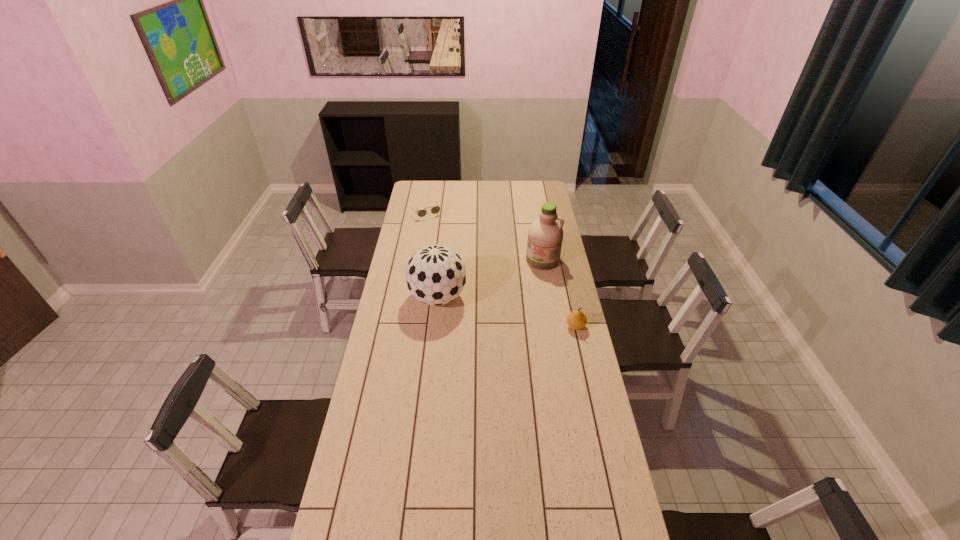
This screenshot has width=960, height=540. In the image, there is a desktop. Identify the location of vacant space at the far edge. point(487,188).

Locate an element on the screen. This screenshot has width=960, height=540. vacant space at the near edge of the desktop is located at coordinates (551, 516).

Identify the location of vacant space at the left edge of the desktop. This screenshot has width=960, height=540. (405, 298).

This screenshot has height=540, width=960. I want to click on vacant space at the right edge, so click(529, 203).

Where is `vacant space that's between the second farthest object and the nearest object`? This screenshot has height=540, width=960. vacant space that's between the second farthest object and the nearest object is located at coordinates (559, 293).

Identify the location of free point between the farthest object and the pear. (500, 269).

Where is `free space between the tallest object and the farthest object`? The image size is (960, 540). free space between the tallest object and the farthest object is located at coordinates pyautogui.click(x=484, y=237).

Locate an element on the screen. The image size is (960, 540). empty space between the cleansing agent and the second tallest object is located at coordinates (491, 279).

The image size is (960, 540). What are the coordinates of `free space that is in between the second farthest object and the third tallest object` in the screenshot? It's located at (559, 293).

At what (x,y) coordinates should I click in order to perform the action: click on free space between the third tallest object and the third farthest object. Please return your answer as a coordinate pair (x, y). Image resolution: width=960 pixels, height=540 pixels. Looking at the image, I should click on (507, 312).